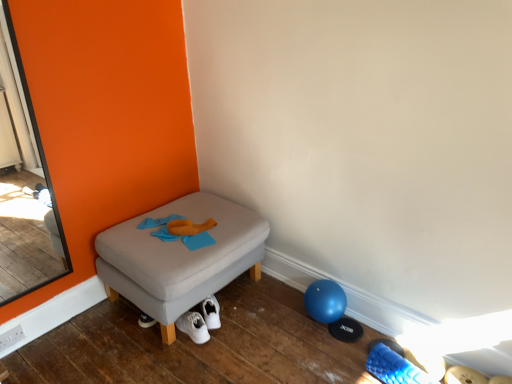
The width and height of the screenshot is (512, 384). I want to click on vacant space in front of matte gray ottoman at center, so click(184, 360).